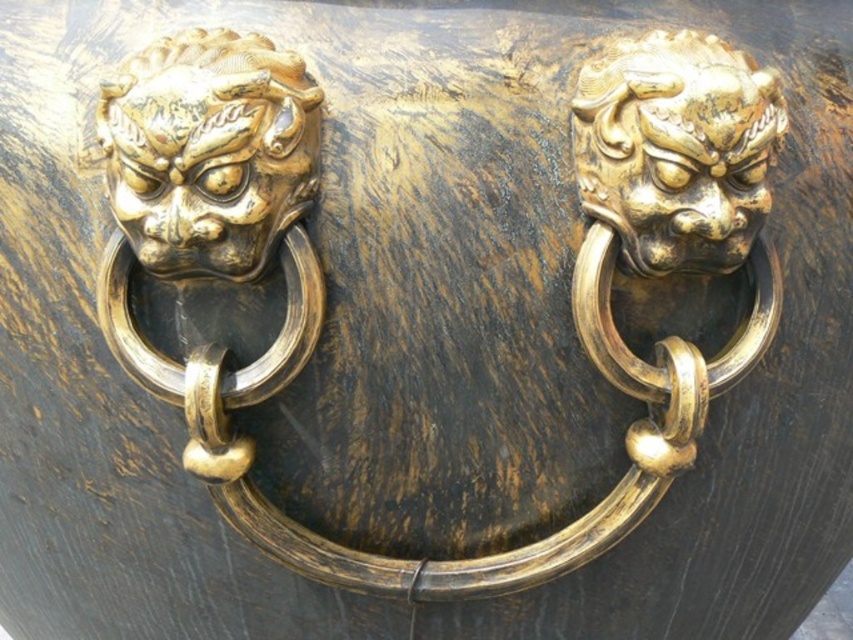
You are an interior designer assessing the placement of the gold polished lion head at left and the gold polished lion head at upper right on a wooden door. Which lion head is positioned lower on the door?

The gold polished lion head at left is positioned lower on the door than the gold polished lion head at upper right.

You are standing in front of a large wooden door with two lion head handles. The gold polished lion head at left and another lion head are mounted on the door. Based on their positions, which lion head is closer to the top edge of the door?

The gold polished lion head at left is located at point 0.245 on the vertical axis, which is closer to the top edge of the door compared to the other lion head.